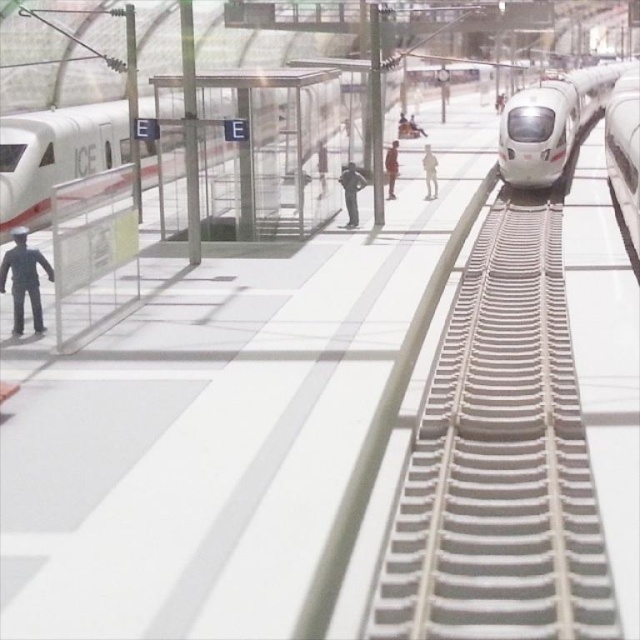
Can you confirm if gray metallic train track at center is positioned to the left of black matte figure at left?

In fact, gray metallic train track at center is to the right of black matte figure at left.

From the picture: Is gray metallic train track at center further to the viewer compared to black matte figure at left?

That is False.

Which is behind, point (490, 244) or point (17, 236)?

Positioned behind is point (490, 244).

Identify the location of gray metallic train track at center. This screenshot has width=640, height=640. (499, 460).

Is white glossy train at center to the right of white matte figure at center from the viewer's perspective?

Correct, you'll find white glossy train at center to the right of white matte figure at center.

Can you confirm if white glossy train at center is smaller than white matte figure at center?

No, white glossy train at center is not smaller than white matte figure at center.

Where is `white glossy train at center`? white glossy train at center is located at coordinates (547, 124).

Can you confirm if white glossy train at right is shorter than black matte figure at left?

Incorrect, white glossy train at right's height does not fall short of black matte figure at left's.

Find the location of a particular element. The height and width of the screenshot is (640, 640). white glossy train at right is located at coordinates (624, 150).